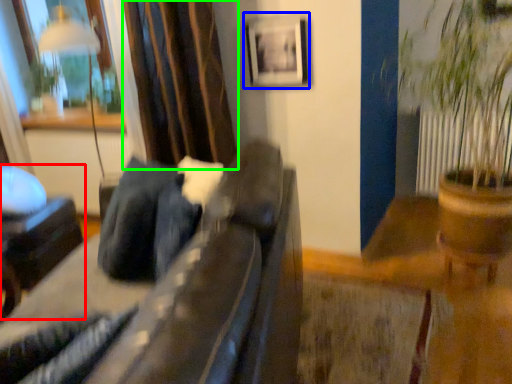
Question: Which object is positioned farthest from furniture (highlighted by a red box)? Select from picture frame (highlighted by a blue box) and curtain (highlighted by a green box).

Choices:
 (A) picture frame
 (B) curtain

Answer: (A)